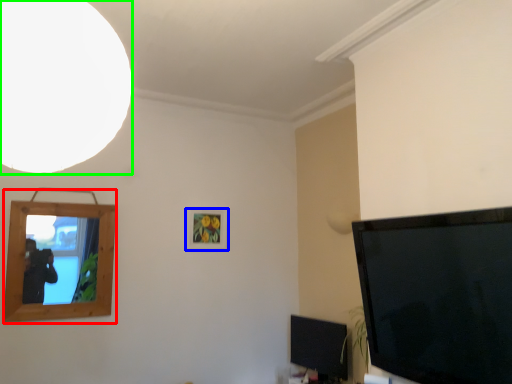
Question: Which object is positioned farthest from picture frame (highlighted by a red box)? Select from picture frame (highlighted by a blue box) and light (highlighted by a green box).

Choices:
 (A) picture frame
 (B) light

Answer: (B)